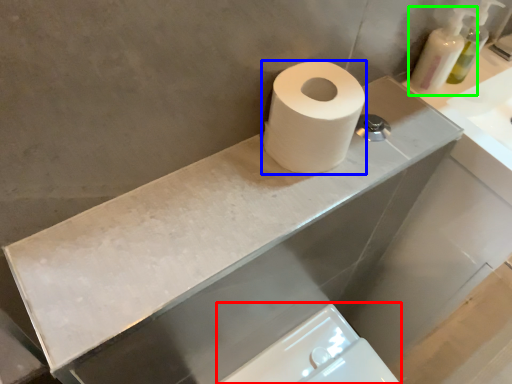
Question: Considering the real-world distances, which object is closest to bidet (highlighted by a red box)? toilet paper (highlighted by a blue box) or soap dispenser (highlighted by a green box).

Choices:
 (A) toilet paper
 (B) soap dispenser

Answer: (A)